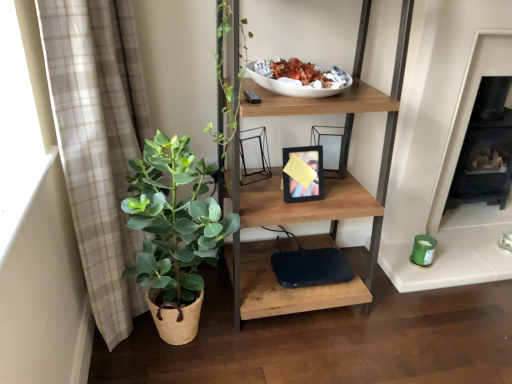
Identify the location of vacant space to the right of green leafy plant in woven basket at left. Image resolution: width=512 pixels, height=384 pixels. (268, 359).